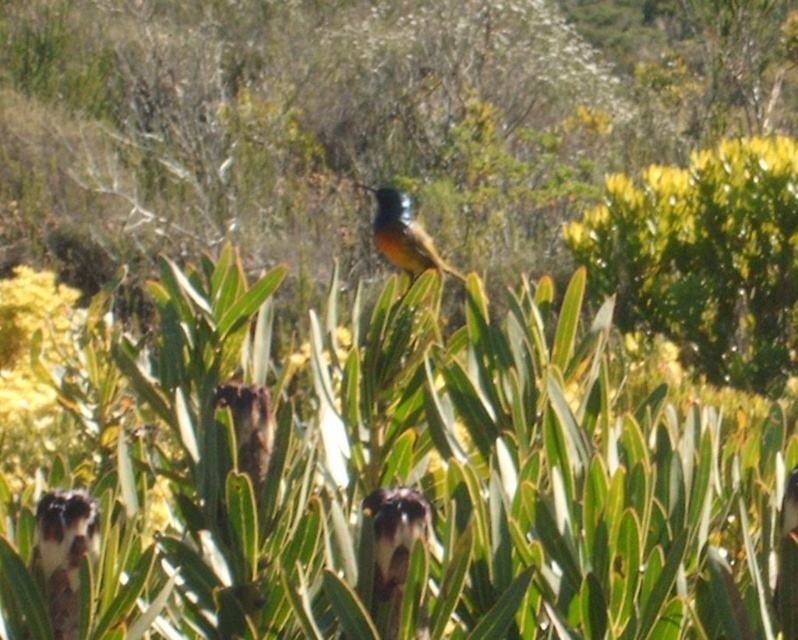
Question: Is green leafy bush at upper right closer to the viewer compared to shiny blue bird at center?

Choices:
 (A) no
 (B) yes

Answer: (A)

Question: Which point is farther to the camera?

Choices:
 (A) (423, 248)
 (B) (690, 250)

Answer: (B)

Question: Which of the following is the closest to the observer?

Choices:
 (A) green leafy bush at upper right
 (B) shiny blue bird at center

Answer: (B)

Question: Does green leafy bush at upper right appear on the right side of shiny blue bird at center?

Choices:
 (A) no
 (B) yes

Answer: (B)

Question: In this image, where is green leafy bush at upper right located relative to shiny blue bird at center?

Choices:
 (A) right
 (B) left

Answer: (A)